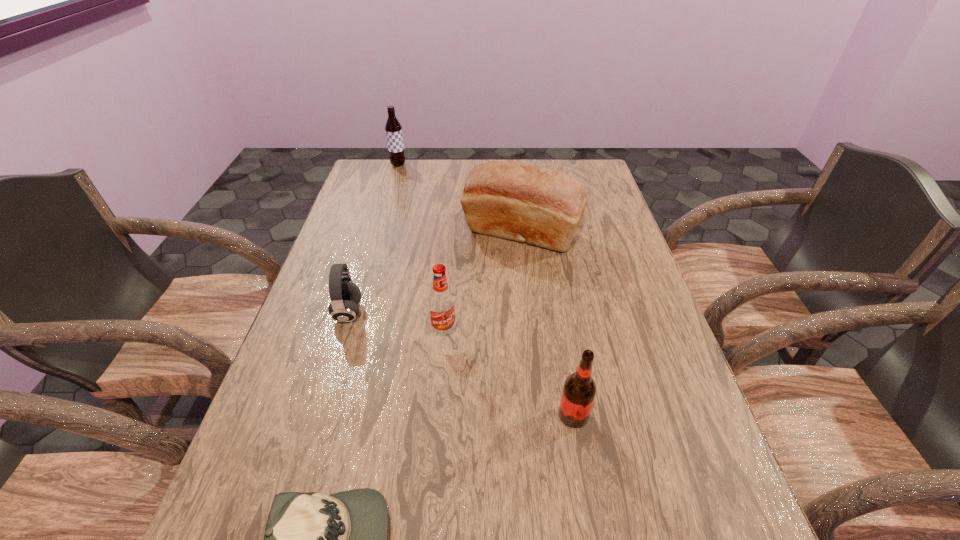
At what (x,y) coordinates should I click in order to perform the action: click on blank space located on the front of the second farthest root beer. Please return your answer as a coordinate pair (x, y). Looking at the image, I should click on (435, 446).

The image size is (960, 540). Find the location of `free location located on the back of the nearest root beer`. free location located on the back of the nearest root beer is located at coordinates (549, 274).

What are the coordinates of `vacant space located 0.350m on the ear cups of the headset` in the screenshot? It's located at (506, 313).

Find the location of a particular element. The image size is (960, 540). object that is at the far edge is located at coordinates (393, 128).

At what (x,y) coordinates should I click in order to perform the action: click on root beer situated at the left edge. Please return your answer as a coordinate pair (x, y). Looking at the image, I should click on (393, 128).

This screenshot has height=540, width=960. I want to click on headset that is at the left edge, so click(x=345, y=295).

Where is `object present at the right edge`? This screenshot has width=960, height=540. object present at the right edge is located at coordinates (522, 202).

Locate an element on the screen. The height and width of the screenshot is (540, 960). object located at the far left corner is located at coordinates (393, 128).

Where is `vacant region at the far edge of the desktop`? The image size is (960, 540). vacant region at the far edge of the desktop is located at coordinates (444, 166).

This screenshot has height=540, width=960. In order to click on free space at the left edge in this screenshot , I will do `click(306, 418)`.